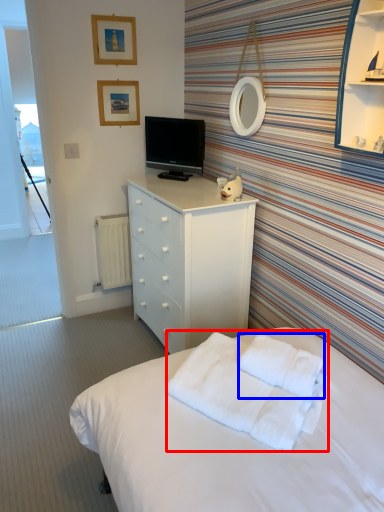
Question: Which point is closer to the camera, blanket (highlighted by a red box) or cloth (highlighted by a blue box)?

Choices:
 (A) blanket
 (B) cloth

Answer: (A)